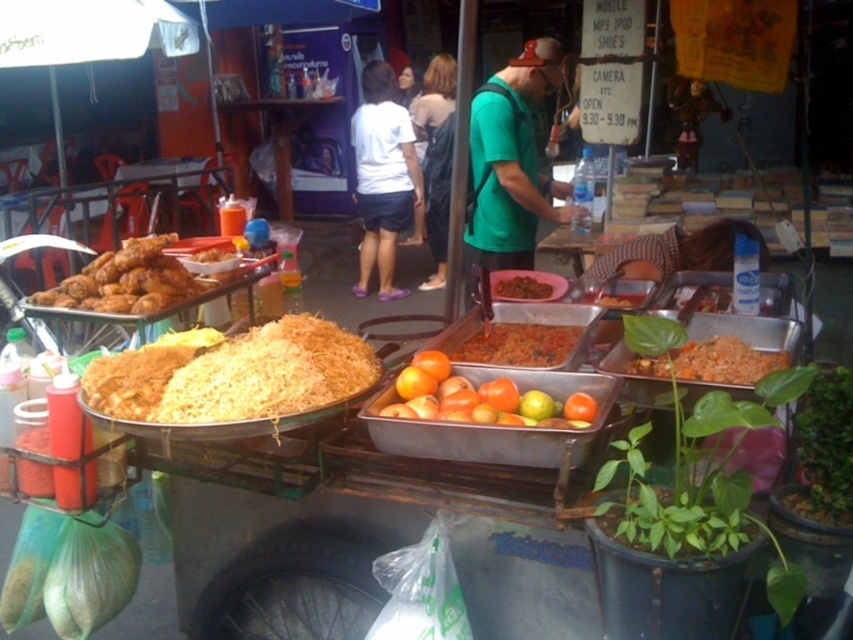
Is shiny red sauce at center positioned before dark blue dress at center?

Yes, it is.

Is shiny red sauce at center smaller than dark blue dress at center?

Yes, shiny red sauce at center is smaller than dark blue dress at center.

Between point (543, 364) and point (438, 108), which one is positioned behind?

The point (438, 108) is behind.

Identify the location of shiny red sauce at center. coord(518,344).

This screenshot has height=640, width=853. What are the coordinates of `brown matte rice at center` in the screenshot? It's located at (520, 288).

Measure the distance between point (x=498, y=276) and camera.

Point (x=498, y=276) and camera are 8.39 feet apart.

Who is more distant from viewer, (532, 296) or (619, 298)?

Point (619, 298)

I want to click on brown matte rice at center, so click(520, 288).

Does orange matte fruit at center appear over orange matte tomatoes at center?

Actually, orange matte fruit at center is below orange matte tomatoes at center.

Does point (544, 396) come farther from viewer compared to point (614, 305)?

No, it is in front of (614, 305).

You are a GUI agent. You are given a task and a screenshot of the screen. Output one action in this format:
    pyautogui.click(x=<x>, y=<y>)
    Task: Click on the orange matte fruit at center
    This screenshot has height=640, width=853.
    Given the screenshot: What is the action you would take?
    480,400

You are a GUI agent. You are given a task and a screenshot of the screen. Output one action in this format:
    pyautogui.click(x=<x>, y=<y>)
    Task: Click on the orange matte fruit at center
    Image resolution: width=853 pixels, height=640 pixels.
    Given the screenshot: What is the action you would take?
    pyautogui.click(x=480, y=400)